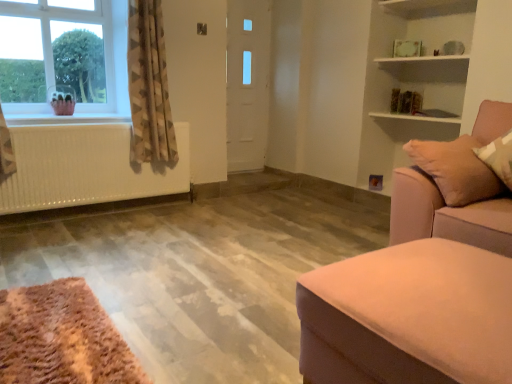
The height and width of the screenshot is (384, 512). In order to click on free location above white matte radiator at left (from a real-world perspective) in this screenshot , I will do `click(69, 120)`.